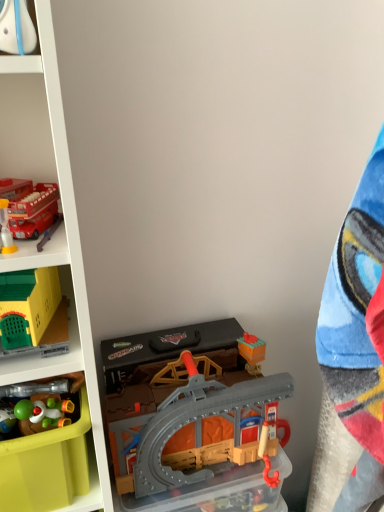
What is the approximate height of translucent plastic storage box at center, which is the first storage box in right-to-left order?

5.56 inches.

Where is `plastic/grey track at lower center, which is the first toy in right-to-left order`? plastic/grey track at lower center, which is the first toy in right-to-left order is located at coordinates (191, 423).

Describe the element at coordinates (46, 466) in the screenshot. This screenshot has height=512, width=384. I see `matte green plastic storage box at lower left, the second storage box from the right` at that location.

Consider the image. In order to face translucent yellow bottle at upper left, which ranks as the 2th toy in left-to-right order, should I rotate leftwards or rightwards?

To align with it, rotate left about 23.452°.

Find the location of a particular element. The height and width of the screenshot is (512, 384). shiny plastic toy at lower left, the 3th toy from the right is located at coordinates (41, 404).

Where is `storage box that is the 1st one below the matte red bus at upper left, marked as the second toy in a right-to-left arrangement (from a real-world perspective)`? This screenshot has width=384, height=512. storage box that is the 1st one below the matte red bus at upper left, marked as the second toy in a right-to-left arrangement (from a real-world perspective) is located at coordinates (46, 466).

Considering the points (19, 211) and (55, 488), which point is behind, point (19, 211) or point (55, 488)?

The point (55, 488) is more distant.

Based on the photo, does matte red bus at upper left, which ranks as the fourth toy in left-to-right order, appear on the right side of matte green plastic storage box at lower left, the first storage box when ordered from left to right?

Indeed, matte red bus at upper left, which ranks as the fourth toy in left-to-right order, is positioned on the right side of matte green plastic storage box at lower left, the first storage box when ordered from left to right.

Considering the sizes of translucent plastic storage box at center, which is the first storage box in right-to-left order, and matte green plastic storage box at lower left, the second storage box from the right, in the image, is translucent plastic storage box at center, which is the first storage box in right-to-left order, taller or shorter than matte green plastic storage box at lower left, the second storage box from the right,?

translucent plastic storage box at center, which is the first storage box in right-to-left order, is shorter than matte green plastic storage box at lower left, the second storage box from the right.

From the image's perspective, is translucent plastic storage box at center, which is the 2th storage box from left to right, above or below matte green plastic storage box at lower left, the first storage box when ordered from left to right?

From the image's perspective, translucent plastic storage box at center, which is the 2th storage box from left to right, appears below matte green plastic storage box at lower left, the first storage box when ordered from left to right.

Consider the image. Who is bigger, translucent plastic storage box at center, which is the first storage box in right-to-left order, or matte green plastic storage box at lower left, the second storage box from the right?

Bigger between the two is matte green plastic storage box at lower left, the second storage box from the right.

Is translucent plastic storage box at center, which is the first storage box in right-to-left order, directly adjacent to matte green plastic storage box at lower left, the second storage box from the right?

No, translucent plastic storage box at center, which is the first storage box in right-to-left order, is not touching matte green plastic storage box at lower left, the second storage box from the right.

From a real-world perspective, is yellow plastic playhouse at left, which is the fifth toy from right to left, under matte green plastic storage box at lower left, the first storage box when ordered from left to right?

No.

Can you confirm if yellow plastic playhouse at left, which is the fifth toy from right to left, is shorter than matte green plastic storage box at lower left, the second storage box from the right?

Yes, yellow plastic playhouse at left, which is the fifth toy from right to left, is shorter than matte green plastic storage box at lower left, the second storage box from the right.

Consider the image. Could you tell me if yellow plastic playhouse at left, arranged as the first toy when viewed from the left, is turned towards matte green plastic storage box at lower left, the second storage box from the right?

No, yellow plastic playhouse at left, arranged as the first toy when viewed from the left, is not aimed at matte green plastic storage box at lower left, the second storage box from the right.

Is matte green plastic storage box at lower left, the second storage box from the right, surrounded by yellow plastic playhouse at left, arranged as the first toy when viewed from the left?

No.

Considering the relative sizes of matte red bus at upper left, which ranks as the fourth toy in left-to-right order, and translucent plastic storage box at center, which is the 2th storage box from left to right, in the image provided, is matte red bus at upper left, which ranks as the fourth toy in left-to-right order, smaller than translucent plastic storage box at center, which is the 2th storage box from left to right,?

Yes.

From the image's perspective, is matte red bus at upper left, marked as the second toy in a right-to-left arrangement, above translucent plastic storage box at center, which is the 2th storage box from left to right?

Yes, from the image's perspective, matte red bus at upper left, marked as the second toy in a right-to-left arrangement, is above translucent plastic storage box at center, which is the 2th storage box from left to right.

Who is shorter, matte red bus at upper left, marked as the second toy in a right-to-left arrangement, or translucent plastic storage box at center, which is the first storage box in right-to-left order?

Standing shorter between the two is matte red bus at upper left, marked as the second toy in a right-to-left arrangement.

Is matte red bus at upper left, which ranks as the fourth toy in left-to-right order, thinner than translucent plastic storage box at center, which is the 2th storage box from left to right?

Yes, matte red bus at upper left, which ranks as the fourth toy in left-to-right order, is thinner than translucent plastic storage box at center, which is the 2th storage box from left to right.

From a real-world perspective, is plastic yellow toy storage at left physically above matte red bus at upper left, marked as the second toy in a right-to-left arrangement?

No, from a real-world perspective, plastic yellow toy storage at left is not over matte red bus at upper left, marked as the second toy in a right-to-left arrangement

Considering the positions of objects plastic yellow toy storage at left and matte red bus at upper left, marked as the second toy in a right-to-left arrangement, in the image provided, who is more to the left, plastic yellow toy storage at left or matte red bus at upper left, marked as the second toy in a right-to-left arrangement,?

From the viewer's perspective, plastic yellow toy storage at left appears more on the left side.

Locate an element on the screen. The width and height of the screenshot is (384, 512). the 3rd toy behind the plastic yellow toy storage at left is located at coordinates (32, 208).

Considering the relative sizes of plastic yellow toy storage at left and matte red bus at upper left, which ranks as the fourth toy in left-to-right order, in the image provided, is plastic yellow toy storage at left wider than matte red bus at upper left, which ranks as the fourth toy in left-to-right order,?

Correct, the width of plastic yellow toy storage at left exceeds that of matte red bus at upper left, which ranks as the fourth toy in left-to-right order.

Which of these two, plastic/grey track at lower center, which is the first toy in right-to-left order, or matte green plastic storage box at lower left, the second storage box from the right, is thinner?

plastic/grey track at lower center, which is the first toy in right-to-left order, is thinner.

Identify the location of storage box on the left side of plastic/grey track at lower center, positioned as the 5th toy in left-to-right order. This screenshot has width=384, height=512. (46, 466).

Consider the image. From the image's perspective, does plastic/grey track at lower center, positioned as the 5th toy in left-to-right order, appear higher than matte green plastic storage box at lower left, the second storage box from the right?

Incorrect, from the image's perspective, plastic/grey track at lower center, positioned as the 5th toy in left-to-right order, is lower than matte green plastic storage box at lower left, the second storage box from the right.

From a real-world perspective, which object stands above the other?

matte green plastic storage box at lower left, the first storage box when ordered from left to right.

Is shiny plastic toy at lower left, the 3th toy from the right, next to plastic/grey track at lower center, positioned as the 5th toy in left-to-right order?

No, shiny plastic toy at lower left, the 3th toy from the right, is not in contact with plastic/grey track at lower center, positioned as the 5th toy in left-to-right order.

How far apart are shiny plastic toy at lower left, the 3th toy from the right, and plastic/grey track at lower center, which is the first toy in right-to-left order?

10.84 inches.

In the scene shown: Which is more to the right, shiny plastic toy at lower left, the third toy viewed from the left, or plastic/grey track at lower center, which is the first toy in right-to-left order?

Positioned to the right is plastic/grey track at lower center, which is the first toy in right-to-left order.

The image size is (384, 512). I want to click on toy that is the 4th one when counting rightward from the matte green plastic storage box at lower left, the first storage box when ordered from left to right, so click(x=32, y=208).

Identify the location of storage box that is above the translucent plastic storage box at center, which is the 2th storage box from left to right (from the image's perspective). The width and height of the screenshot is (384, 512). click(x=46, y=466).

Looking at the image, which one is located closer to shiny plastic toy at lower left, the 3th toy from the right, translucent yellow bottle at upper left, placed as the fourth toy when sorted from right to left, or yellow plastic playhouse at left, arranged as the first toy when viewed from the left?

The object closer to shiny plastic toy at lower left, the 3th toy from the right, is yellow plastic playhouse at left, arranged as the first toy when viewed from the left.

Which object lies nearer to the anchor point translucent yellow bottle at upper left, which ranks as the 2th toy in left-to-right order, matte green plastic storage box at lower left, the first storage box when ordered from left to right, or yellow plastic playhouse at left, which is the fifth toy from right to left?

Among the two, yellow plastic playhouse at left, which is the fifth toy from right to left, is located nearer to translucent yellow bottle at upper left, which ranks as the 2th toy in left-to-right order.

Which object lies further to the anchor point shiny plastic toy at lower left, the third toy viewed from the left, matte red bus at upper left, which ranks as the fourth toy in left-to-right order, or yellow plastic playhouse at left, arranged as the first toy when viewed from the left?

matte red bus at upper left, which ranks as the fourth toy in left-to-right order, is positioned further to the anchor shiny plastic toy at lower left, the third toy viewed from the left.

From the image, which object appears to be nearer to translucent yellow bottle at upper left, which ranks as the 2th toy in left-to-right order, matte red bus at upper left, marked as the second toy in a right-to-left arrangement, or yellow plastic playhouse at left, which is the fifth toy from right to left?

Based on the image, matte red bus at upper left, marked as the second toy in a right-to-left arrangement, appears to be nearer to translucent yellow bottle at upper left, which ranks as the 2th toy in left-to-right order.

Looking at the image, which one is located closer to shiny plastic toy at lower left, the 3th toy from the right, matte red bus at upper left, marked as the second toy in a right-to-left arrangement, or matte green plastic storage box at lower left, the second storage box from the right?

matte green plastic storage box at lower left, the second storage box from the right.

Looking at the image, which one is located closer to shiny plastic toy at lower left, the 3th toy from the right, plastic/grey track at lower center, which is the first toy in right-to-left order, or yellow plastic playhouse at left, arranged as the first toy when viewed from the left?

yellow plastic playhouse at left, arranged as the first toy when viewed from the left, lies closer to shiny plastic toy at lower left, the 3th toy from the right, than the other object.

Based on their spatial positions, is plastic/grey track at lower center, positioned as the 5th toy in left-to-right order, or matte red bus at upper left, marked as the second toy in a right-to-left arrangement, further from matte green plastic storage box at lower left, the first storage box when ordered from left to right?

matte red bus at upper left, marked as the second toy in a right-to-left arrangement.

Consider the image. From the image, which object appears to be nearer to translucent plastic storage box at center, which is the first storage box in right-to-left order, matte red bus at upper left, which ranks as the fourth toy in left-to-right order, or matte green plastic storage box at lower left, the second storage box from the right?

matte green plastic storage box at lower left, the second storage box from the right, lies closer to translucent plastic storage box at center, which is the first storage box in right-to-left order, than the other object.

Where is `shelf between matte red bus at upper left, marked as the second toy in a right-to-left arrangement, and shiny plastic toy at lower left, the third toy viewed from the left, from top to bottom`? Image resolution: width=384 pixels, height=512 pixels. shelf between matte red bus at upper left, marked as the second toy in a right-to-left arrangement, and shiny plastic toy at lower left, the third toy viewed from the left, from top to bottom is located at coordinates (57, 230).

At what (x,y) coordinates should I click in order to perform the action: click on shelf between translucent yellow bottle at upper left, which ranks as the 2th toy in left-to-right order, and matte green plastic storage box at lower left, the second storage box from the right, in the vertical direction. Please return your answer as a coordinate pair (x, y). Looking at the image, I should click on (57, 230).

The height and width of the screenshot is (512, 384). What are the coordinates of `storage box between matte red bus at upper left, which ranks as the fourth toy in left-to-right order, and plastic/grey track at lower center, positioned as the 5th toy in left-to-right order, from top to bottom` in the screenshot? It's located at (46, 466).

At what (x,y) coordinates should I click in order to perform the action: click on storage box that lies between translucent yellow bottle at upper left, which ranks as the 2th toy in left-to-right order, and plastic/grey track at lower center, positioned as the 5th toy in left-to-right order, from top to bottom. Please return your answer as a coordinate pair (x, y). This screenshot has height=512, width=384. Looking at the image, I should click on (46, 466).